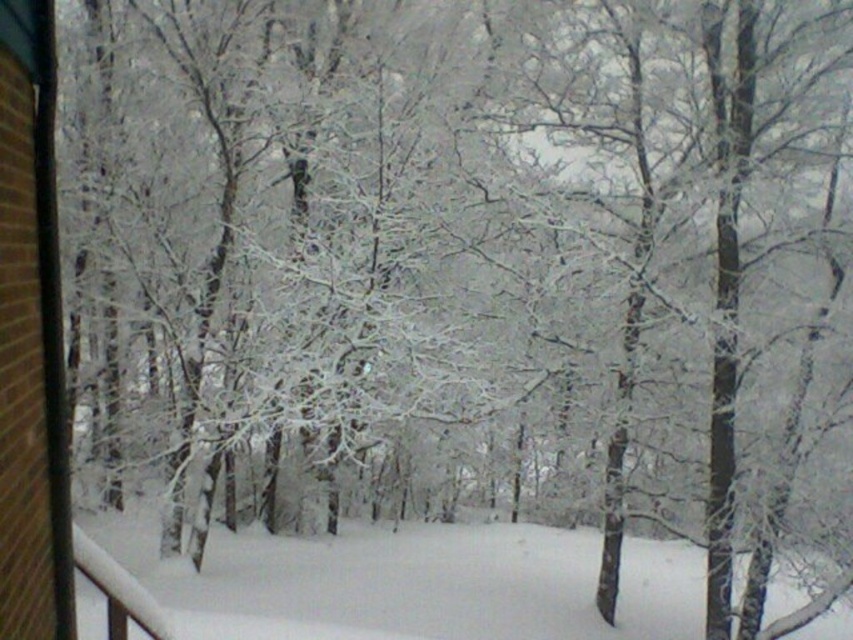
From the picture: You are standing on the porch and looking at two points in the winter scene. The first point is at coordinate (532, 596) and the second is at (35, 220). Which point is closer to you?

Point (532, 596) is further to the viewer than point (35, 220), so the second point at (35, 220) is closer to you.

From the picture: You are standing inside a building with a view of the winter scene. You notice the brown brick window at left and the white fluffy snow at center. From your position, which object is located to the right of the other?

The white fluffy snow at center is to the right of the brown brick window at left.